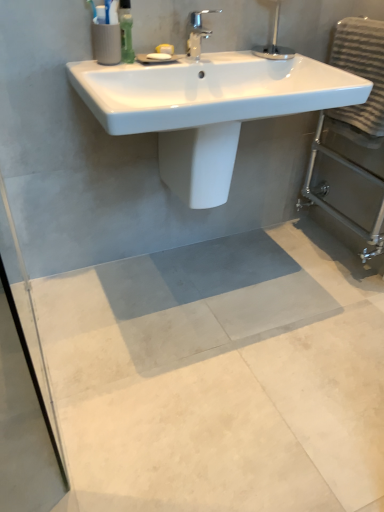
Find the location of a particular element. This screenshot has width=384, height=512. free space underneath gray textured towel at right (from a real-world perspective) is located at coordinates (322, 250).